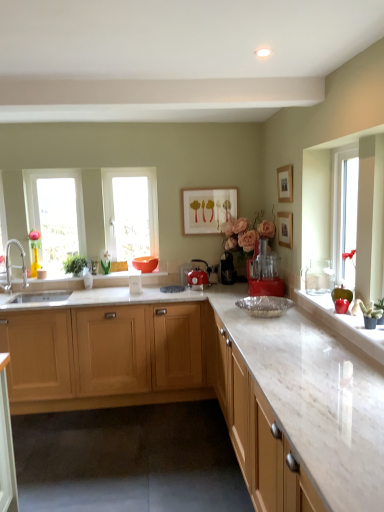
Locate an element on the screen. light wood cabinetry at center, which is the second cabinetry from front to back is located at coordinates (108, 356).

Where is `green leafy plant at left, which is the first plant in top-to-bottom order`? green leafy plant at left, which is the first plant in top-to-bottom order is located at coordinates (74, 264).

Image resolution: width=384 pixels, height=512 pixels. What do you see at coordinates (130, 212) in the screenshot?
I see `transparent glass window at center, which ranks as the 2th window in left-to-right order` at bounding box center [130, 212].

Describe the element at coordinates (285, 183) in the screenshot. The image size is (384, 512). I see `matte wooden picture frame at upper right, positioned as the 2th picture frame in right-to-left order` at that location.

The width and height of the screenshot is (384, 512). What do you see at coordinates (370, 310) in the screenshot?
I see `green matte cactus at right, positioned as the second plant in back-to-front order` at bounding box center [370, 310].

The width and height of the screenshot is (384, 512). What are the coordinates of `matte red kettle at center` in the screenshot? It's located at (198, 279).

You are a GUI agent. You are given a task and a screenshot of the screen. Output one action in this format:
    pyautogui.click(x=<x>, y=<y>)
    Task: Click on the light wood cabinetry at center, which is the second cabinetry from front to back
    
    Given the screenshot: What is the action you would take?
    pyautogui.click(x=108, y=356)

What's the angular difference between white marble countertop at right, the second cabinetry from the back, and matte wooden picture frame at center, which appears as the first picture frame when viewed from the back,'s facing directions?

89.8 degrees.

Is matte wooden picture frame at center, the 3th picture frame in the right-to-left sequence, completely or partially inside white marble countertop at right, the second cabinetry from the back?

No, matte wooden picture frame at center, the 3th picture frame in the right-to-left sequence, is not a part of white marble countertop at right, the second cabinetry from the back.

From the image's perspective, does white marble countertop at right, the first cabinetry viewed from the front, appear lower than matte wooden picture frame at center, which appears as the first picture frame when viewed from the back?

Yes, from the image's perspective, white marble countertop at right, the first cabinetry viewed from the front, is below matte wooden picture frame at center, which appears as the first picture frame when viewed from the back.

From a real-world perspective, relative to satin nickel faucet at left, is red plastic food processor at center, which is the first coffee machine in right-to-left order, vertically above or below?

Clearly, from a real-world perspective, red plastic food processor at center, which is the first coffee machine in right-to-left order, is below satin nickel faucet at left.

Which is correct: red plastic food processor at center, arranged as the 2th coffee machine when viewed from the back, is inside satin nickel faucet at left, or outside of it?

red plastic food processor at center, arranged as the 2th coffee machine when viewed from the back, cannot be found inside satin nickel faucet at left.

Can you confirm if red plastic food processor at center, which is counted as the first coffee machine, starting from the front, is positioned to the left of satin nickel faucet at left?

No.

Looking at this image, from the image's perspective, does red plastic food processor at center, which is counted as the first coffee machine, starting from the front, appear higher than satin nickel faucet at left?

No, from the image's perspective, red plastic food processor at center, which is counted as the first coffee machine, starting from the front, is not above satin nickel faucet at left.

Is light wood cabinetry at center, which is the second cabinetry from front to back, far from matte wooden picture frame at upper right, the 1th picture frame from the front?

Yes, light wood cabinetry at center, which is the second cabinetry from front to back, and matte wooden picture frame at upper right, the 1th picture frame from the front, are located far from each other.

Is light wood cabinetry at center, which is the second cabinetry from front to back, positioned beyond the bounds of matte wooden picture frame at upper right, the 1th picture frame from the front?

light wood cabinetry at center, which is the second cabinetry from front to back, is positioned outside matte wooden picture frame at upper right, the 1th picture frame from the front.

Locate an element on the screen. cabinetry that is the 2nd object to the left of the matte wooden picture frame at upper right, the 1th picture frame from the front, starting at the anchor is located at coordinates (108, 356).

From the image's perspective, is light wood cabinetry at center, which is the second cabinetry from front to back, above matte wooden picture frame at upper right, arranged as the third picture frame when viewed from the back?

No, from the image's perspective, light wood cabinetry at center, which is the second cabinetry from front to back, is not on top of matte wooden picture frame at upper right, arranged as the third picture frame when viewed from the back.

From a real-world perspective, is transparent glass window at left, positioned as the second window in right-to-left order, physically below satin nickel faucet at left?

No.

Is point (39, 255) in front of point (22, 257)?

No, (39, 255) is behind (22, 257).

At what (x,y) coordinates should I click in order to perform the action: click on tap lying in front of the transparent glass window at left, the first window when ordered from left to right. Please return your answer as a coordinate pair (x, y). This screenshot has height=512, width=384. Looking at the image, I should click on (14, 265).

Considering the relative positions of transparent glass window at left, positioned as the second window in right-to-left order, and satin nickel faucet at left in the image provided, is transparent glass window at left, positioned as the second window in right-to-left order, to the right of satin nickel faucet at left from the viewer's perspective?

Indeed, transparent glass window at left, positioned as the second window in right-to-left order, is positioned on the right side of satin nickel faucet at left.

Between black plastic coffee machine at center, the second coffee machine viewed from the right, and satin nickel faucet at left, which one appears on the right side from the viewer's perspective?

Positioned to the right is black plastic coffee machine at center, the second coffee machine viewed from the right.

From a real-world perspective, who is located lower, black plastic coffee machine at center, positioned as the first coffee machine in back-to-front order, or satin nickel faucet at left?

From a 3D spatial view, black plastic coffee machine at center, positioned as the first coffee machine in back-to-front order, is below.

Is black plastic coffee machine at center, positioned as the first coffee machine in back-to-front order, positioned with its back to satin nickel faucet at left?

That's not correct — black plastic coffee machine at center, positioned as the first coffee machine in back-to-front order, is not looking away from satin nickel faucet at left.

Is matte orange bowl at center a part of matte red kettle at center?

No, matte orange bowl at center is not surrounded by matte red kettle at center.

From the picture: From the image's perspective, is matte red kettle at center located above or below matte orange bowl at center?

matte red kettle at center is situated lower than matte orange bowl at center in the image.

From a real-world perspective, relative to matte orange bowl at center, is matte red kettle at center vertically above or below?

From a real-world perspective, matte red kettle at center is physically below matte orange bowl at center.

Which object is closer to the camera taking this photo, light wood cabinetry at center, which is the 1th cabinetry from back to front, or white marble countertop at right, the second cabinetry from the back?

white marble countertop at right, the second cabinetry from the back, is more forward.

Can you tell me how much light wood cabinetry at center, which is the second cabinetry from front to back, and white marble countertop at right, the first cabinetry viewed from the front, differ in facing direction?

light wood cabinetry at center, which is the second cabinetry from front to back, and white marble countertop at right, the first cabinetry viewed from the front, are facing 89.9 degrees away from each other.

Considering the sizes of objects light wood cabinetry at center, which is the 1th cabinetry from back to front, and white marble countertop at right, the first cabinetry viewed from the front, in the image provided, who is bigger, light wood cabinetry at center, which is the 1th cabinetry from back to front, or white marble countertop at right, the first cabinetry viewed from the front,?

light wood cabinetry at center, which is the 1th cabinetry from back to front, is bigger.

From the image's perspective, does light wood cabinetry at center, which is the 1th cabinetry from back to front, appear higher than white marble countertop at right, the second cabinetry from the back?

Yes, from the image's perspective, light wood cabinetry at center, which is the 1th cabinetry from back to front, is over white marble countertop at right, the second cabinetry from the back.

Locate an element on the screen. This screenshot has width=384, height=512. the 2nd cabinetry in front of the matte wooden picture frame at center, which appears as the first picture frame when viewed from the back, starting your count from the anchor is located at coordinates (256, 432).

This screenshot has width=384, height=512. Identify the location of the 1st coffee machine directly beneath the satin nickel faucet at left (from a real-world perspective). (264, 273).

Looking at this image, based on their spatial positions, is white marble countertop at right, the first cabinetry viewed from the front, or matte wooden picture frame at upper right, positioned as the 2th picture frame in right-to-left order, further from red plastic food processor at center, which is counted as the first coffee machine, starting from the front?

white marble countertop at right, the first cabinetry viewed from the front, is further to red plastic food processor at center, which is counted as the first coffee machine, starting from the front.

Consider the image. Based on their spatial positions, is matte wooden picture frame at upper right, which appears as the 2th picture frame when viewed from the left, or transparent glass window at center, placed as the 1th window when sorted from right to left, further from black plastic coffee machine at center, which is the 1th coffee machine from left to right?

Based on the image, transparent glass window at center, placed as the 1th window when sorted from right to left, appears to be further to black plastic coffee machine at center, which is the 1th coffee machine from left to right.

Based on their spatial positions, is transparent glass window at center, placed as the 1th window when sorted from right to left, or matte wooden picture frame at upper right, the 1th picture frame from the front, further from black plastic coffee machine at center, the second coffee machine viewed from the right?

transparent glass window at center, placed as the 1th window when sorted from right to left, lies further to black plastic coffee machine at center, the second coffee machine viewed from the right, than the other object.

Looking at the image, which one is located closer to black plastic coffee machine at center, the second coffee machine viewed from the right, light wood cabinetry at center, which is the second cabinetry from front to back, or matte orange bowl at center?

matte orange bowl at center lies closer to black plastic coffee machine at center, the second coffee machine viewed from the right, than the other object.

From the image, which object appears to be nearer to satin nickel faucet at left, red plastic food processor at center, which is counted as the first coffee machine, starting from the front, or transparent glass window at left, the first window when ordered from left to right?

Among the two, transparent glass window at left, the first window when ordered from left to right, is located nearer to satin nickel faucet at left.

Which object lies nearer to the anchor point light wood cabinetry at center, which is the 1th cabinetry from back to front, green leafy plant at left, acting as the second plant starting from the front, or transparent glass window at left, the first window when ordered from left to right?

green leafy plant at left, acting as the second plant starting from the front, is positioned closer to the anchor light wood cabinetry at center, which is the 1th cabinetry from back to front.

When comparing their distances from matte wooden picture frame at upper right, the 1th picture frame from the front, does matte wooden picture frame at center, which ranks as the 1th picture frame in left-to-right order, or wooden picture frame at upper right, which is counted as the 2th picture frame, starting from the back, seem further?

matte wooden picture frame at center, which ranks as the 1th picture frame in left-to-right order, is positioned further to the anchor matte wooden picture frame at upper right, the 1th picture frame from the front.

Based on their spatial positions, is black plastic coffee machine at center, which is the 1th coffee machine from left to right, or green leafy plant at left, acting as the second plant starting from the front, closer to satin nickel faucet at left?

green leafy plant at left, acting as the second plant starting from the front, is positioned closer to the anchor satin nickel faucet at left.

Where is `window between green leafy plant at left, which ranks as the 1th plant in left-to-right order, and matte wooden picture frame at center, the 3th picture frame in the right-to-left sequence`? Image resolution: width=384 pixels, height=512 pixels. window between green leafy plant at left, which ranks as the 1th plant in left-to-right order, and matte wooden picture frame at center, the 3th picture frame in the right-to-left sequence is located at coordinates (130, 212).

Locate an element on the screen. plant located between white marble countertop at right, the first cabinetry viewed from the front, and light wood cabinetry at center, which is the 1th cabinetry from back to front, in the depth direction is located at coordinates (370, 310).

Find the location of a particular element. Image resolution: width=384 pixels, height=512 pixels. tap located between white marble countertop at right, the first cabinetry viewed from the front, and transparent glass window at center, which ranks as the 2th window in left-to-right order, in the depth direction is located at coordinates (14, 265).

Identify the location of window positioned between white marble countertop at right, the first cabinetry viewed from the front, and transparent glass window at center, which ranks as the 2th window in left-to-right order, from near to far. The height and width of the screenshot is (512, 384). (56, 213).